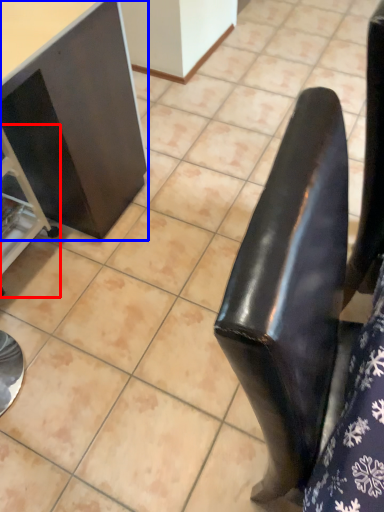
Question: Which point is further to the camera, furniture (highlighted by a red box) or furniture (highlighted by a blue box)?

Choices:
 (A) furniture
 (B) furniture

Answer: (A)